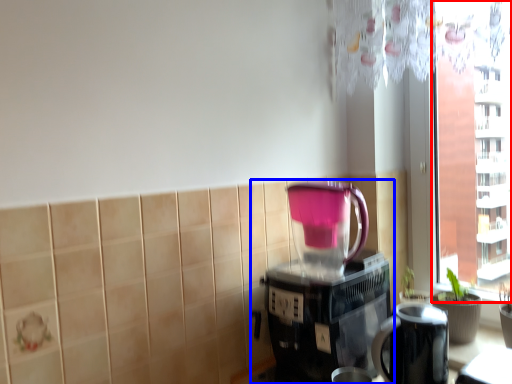
Question: Which object is closer to the camera taking this photo, window screen (highlighted by a red box) or coffee maker (highlighted by a blue box)?

Choices:
 (A) window screen
 (B) coffee maker

Answer: (B)